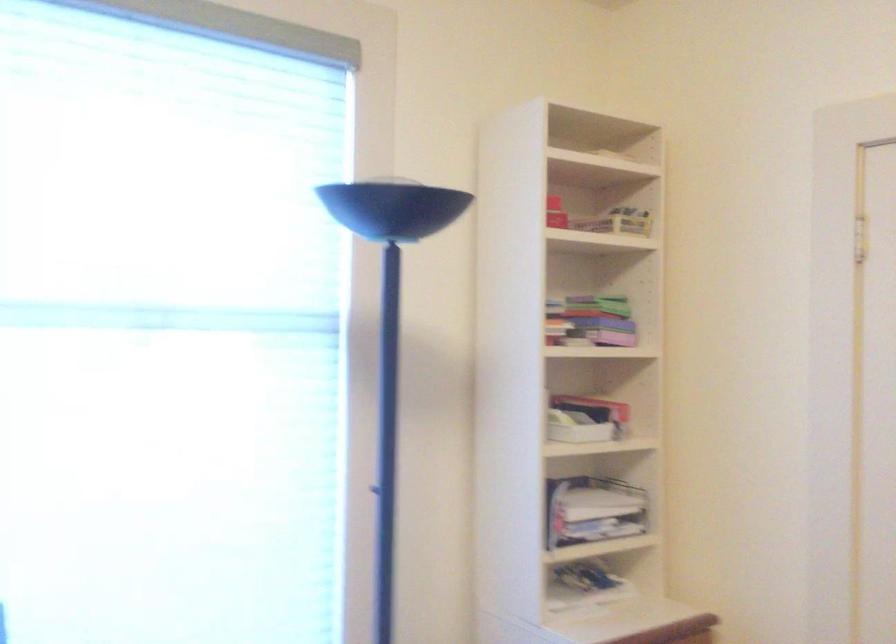
The location [555,213] corresponds to which object?

This point indicates the red rectangular box.